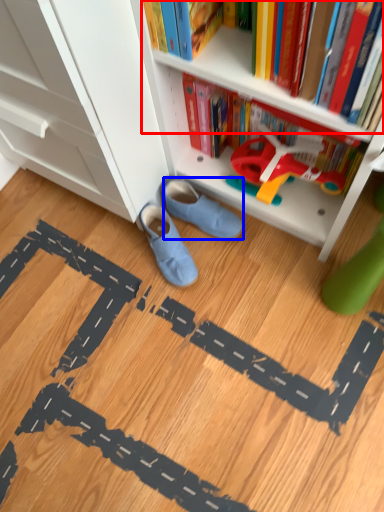
Question: Which object appears farthest to the camera in this image, book (highlighted by a red box) or footwear (highlighted by a blue box)?

Choices:
 (A) book
 (B) footwear

Answer: (B)